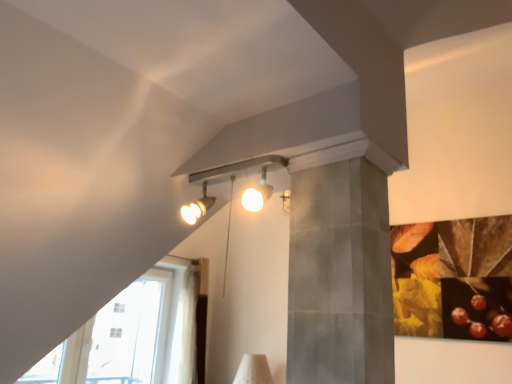
Question: From the image's perspective, is transparent glass door at lower left beneath matte silver track lights at upper center?

Choices:
 (A) yes
 (B) no

Answer: (A)

Question: From a real-world perspective, is transparent glass door at lower left beneath matte silver track lights at upper center?

Choices:
 (A) no
 (B) yes

Answer: (B)

Question: Are transparent glass door at lower left and matte silver track lights at upper center far apart?

Choices:
 (A) no
 (B) yes

Answer: (B)

Question: Is matte silver track lights at upper center at the back of transparent glass door at lower left?

Choices:
 (A) yes
 (B) no

Answer: (B)

Question: Is transparent glass door at lower left touching matte silver track lights at upper center?

Choices:
 (A) no
 (B) yes

Answer: (A)

Question: Is transparent glass door at lower left to the left of matte silver track lights at upper center from the viewer's perspective?

Choices:
 (A) no
 (B) yes

Answer: (B)

Question: Can you confirm if matte silver track lights at upper center is bigger than transparent glass door at lower left?

Choices:
 (A) yes
 (B) no

Answer: (B)

Question: Is matte silver track lights at upper center taller than transparent glass door at lower left?

Choices:
 (A) yes
 (B) no

Answer: (B)

Question: From the image's perspective, is matte silver track lights at upper center on transparent glass door at lower left?

Choices:
 (A) yes
 (B) no

Answer: (A)

Question: From a real-world perspective, is matte silver track lights at upper center under transparent glass door at lower left?

Choices:
 (A) yes
 (B) no

Answer: (B)

Question: Is matte silver track lights at upper center oriented away from transparent glass door at lower left?

Choices:
 (A) yes
 (B) no

Answer: (B)

Question: Considering the relative positions of matte silver track lights at upper center and transparent glass door at lower left in the image provided, is matte silver track lights at upper center in front of transparent glass door at lower left?

Choices:
 (A) yes
 (B) no

Answer: (A)

Question: Considering the positions of point (265, 162) and point (99, 324), is point (265, 162) closer or farther from the camera than point (99, 324)?

Choices:
 (A) farther
 (B) closer

Answer: (B)